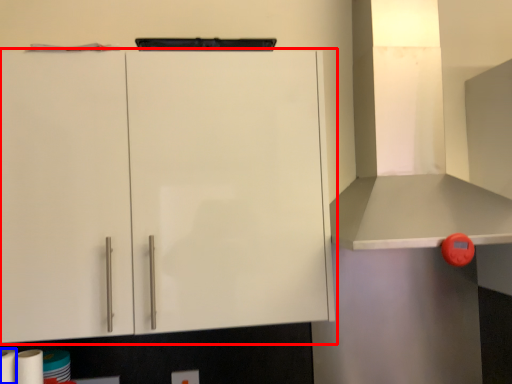
Question: Which object is closer to the camera taking this photo, cabinetry (highlighted by a red box) or paper towel (highlighted by a blue box)?

Choices:
 (A) cabinetry
 (B) paper towel

Answer: (B)